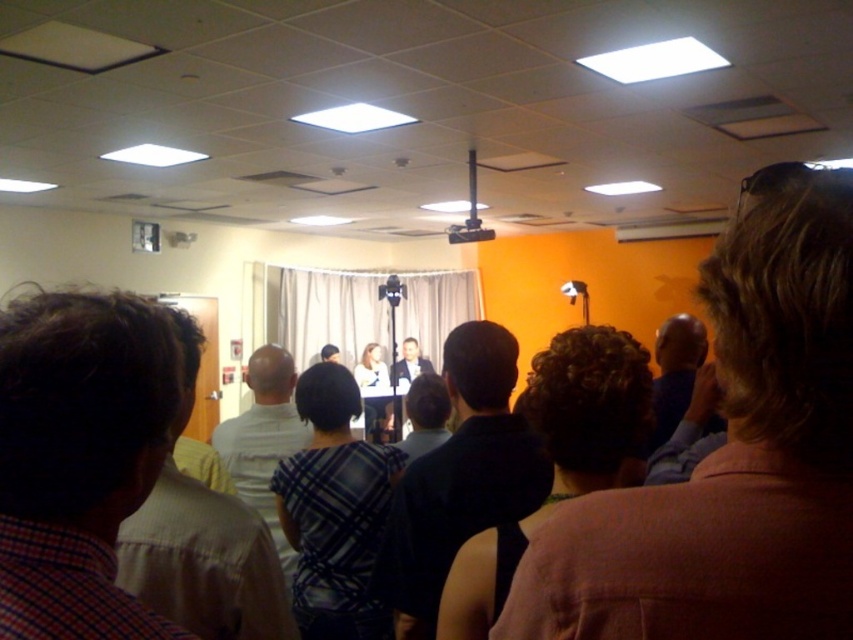
You are sitting in the audience and notice two people on the stage. One is wearing a plaid shirt at left and the other has dark brown hair at center. Which of these two individuals is shorter?

The plaid shirt at left is shorter than the dark brown hair at center.

In the image, there is a point labeled at coordinates (x=78, y=458). Based on the scene description, what object or feature is located at that point?

The point at coordinates (x=78, y=458) indicates the plaid shirt at left.

You are attending a presentation and notice two shirts on the stage. The plaid shirt at left and the light beige shirt at left. Which shirt is covering part of the other?

The plaid shirt at left is positioned over the light beige shirt at left, so the plaid shirt is covering part of the light beige shirt.